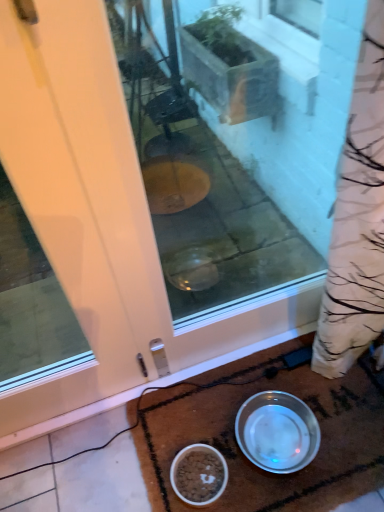
Question: Is white glossy door at center completely or partially inside silver metallic bowl at lower center, which ranks as the 2th bowl in left-to-right order?

Choices:
 (A) no
 (B) yes

Answer: (A)

Question: Does silver metallic bowl at lower center, which ranks as the 2th bowl in left-to-right order, have a lesser width compared to white glossy door at center?

Choices:
 (A) no
 (B) yes

Answer: (A)

Question: Does silver metallic bowl at lower center, which ranks as the 2th bowl in left-to-right order, come behind white glossy door at center?

Choices:
 (A) yes
 (B) no

Answer: (A)

Question: From a real-world perspective, is silver metallic bowl at lower center, which ranks as the 2th bowl in left-to-right order, beneath white glossy door at center?

Choices:
 (A) yes
 (B) no

Answer: (A)

Question: Is silver metallic bowl at lower center, which ranks as the 2th bowl in left-to-right order, smaller than white glossy door at center?

Choices:
 (A) yes
 (B) no

Answer: (A)

Question: Can you confirm if silver metallic bowl at lower center, arranged as the 1th bowl when viewed from the right, is positioned to the left of white glossy door at center?

Choices:
 (A) no
 (B) yes

Answer: (A)

Question: Could you tell me if white glossy door at center is facing white glossy bowl at lower center, which is the 1th bowl in left-to-right order?

Choices:
 (A) yes
 (B) no

Answer: (A)

Question: Would you say white glossy door at center is outside white glossy bowl at lower center, which is the 1th bowl in left-to-right order?

Choices:
 (A) yes
 (B) no

Answer: (A)

Question: Is white glossy door at center shorter than white glossy bowl at lower center, which is the 1th bowl in left-to-right order?

Choices:
 (A) yes
 (B) no

Answer: (B)

Question: Is white glossy door at center at the left side of white glossy bowl at lower center, which is the 1th bowl in left-to-right order?

Choices:
 (A) yes
 (B) no

Answer: (A)

Question: Considering the relative sizes of white glossy door at center and white glossy bowl at lower center, which is the 1th bowl in left-to-right order, in the image provided, is white glossy door at center wider than white glossy bowl at lower center, which is the 1th bowl in left-to-right order,?

Choices:
 (A) yes
 (B) no

Answer: (B)

Question: From a real-world perspective, is white glossy door at center beneath white glossy bowl at lower center, the second bowl from the right?

Choices:
 (A) no
 (B) yes

Answer: (A)

Question: Considering the relative sizes of white glossy bowl at lower center, the second bowl from the right, and silver metallic bowl at lower center, which ranks as the 2th bowl in left-to-right order, in the image provided, is white glossy bowl at lower center, the second bowl from the right, taller than silver metallic bowl at lower center, which ranks as the 2th bowl in left-to-right order,?

Choices:
 (A) yes
 (B) no

Answer: (B)